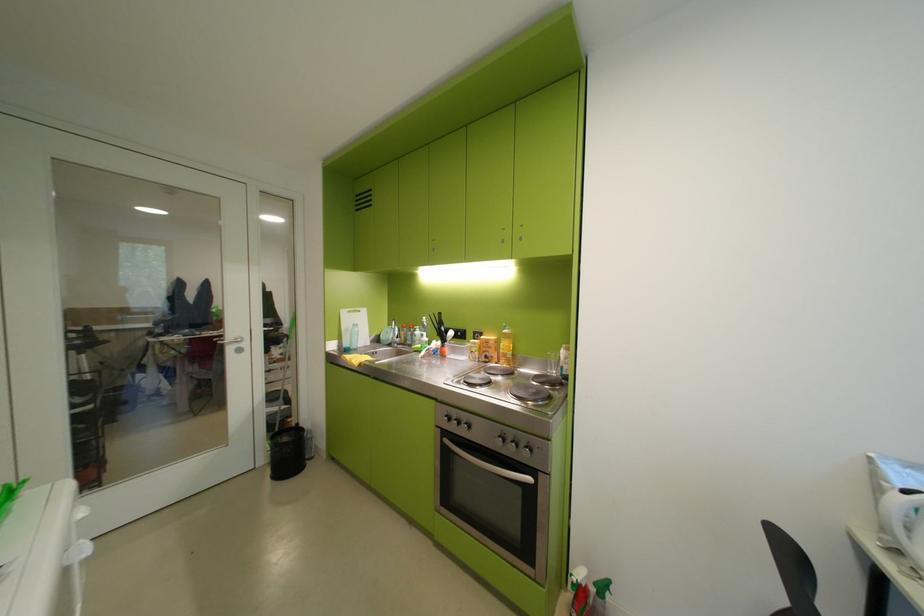
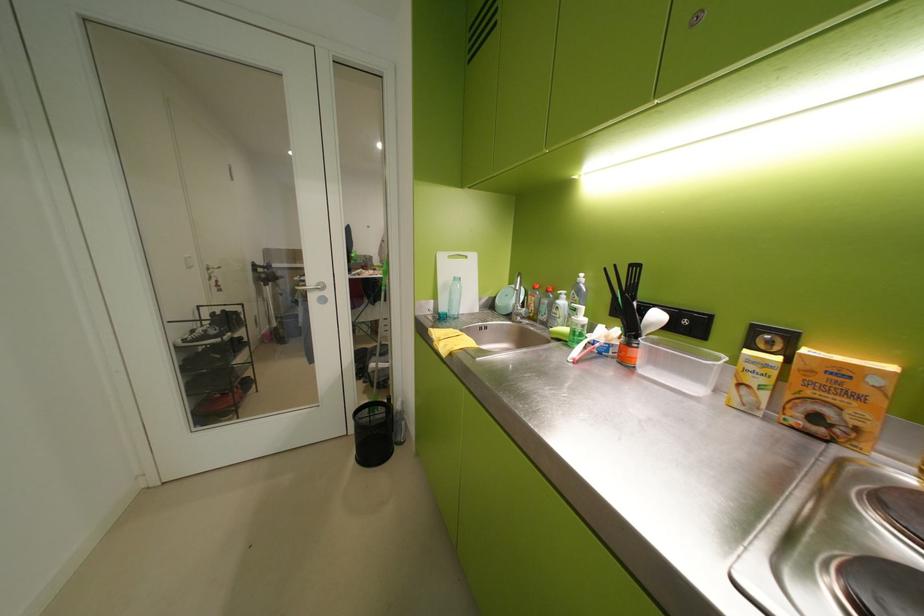
The point at (454, 330) is marked in the first image. Where is the corresponding point in the second image?

(646, 304)